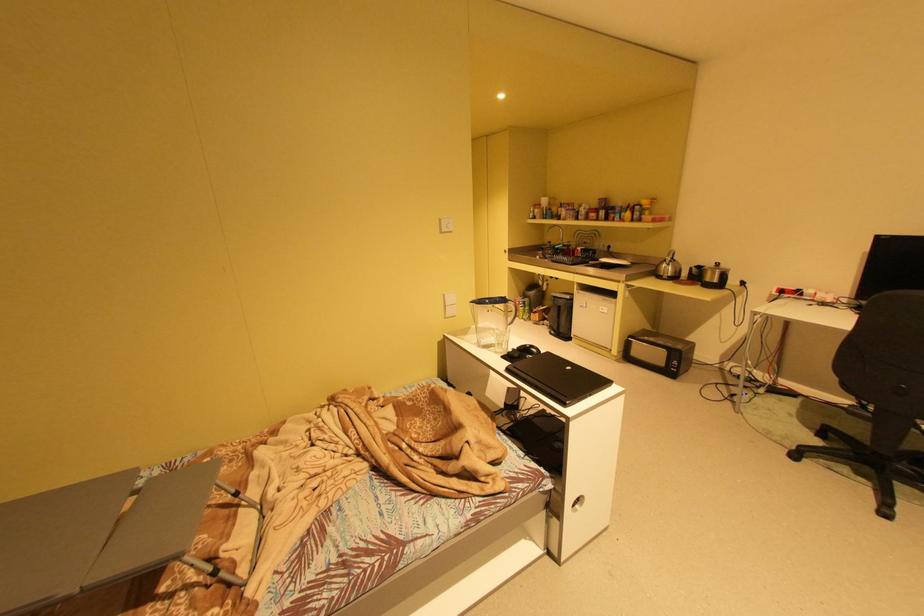
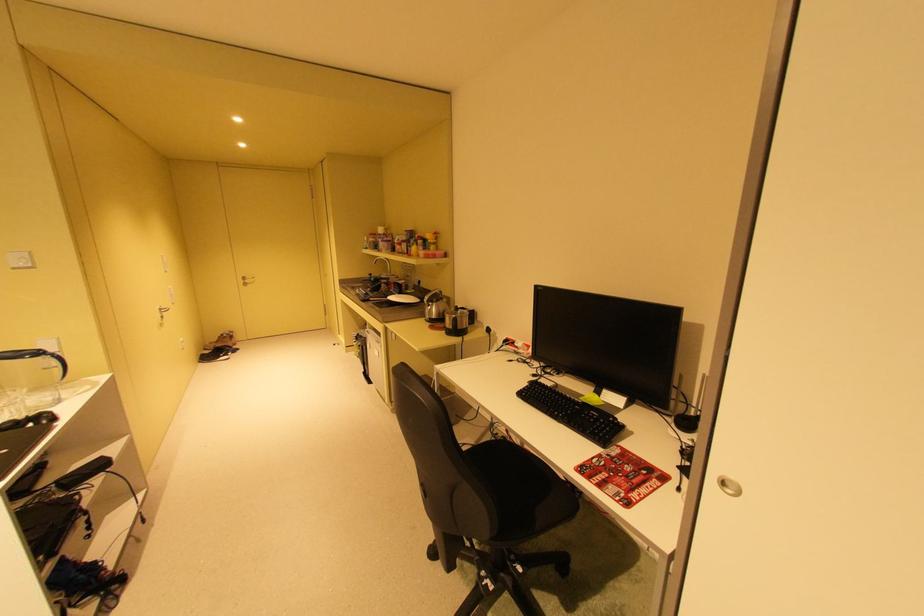
In the second image, find the point that corresponds to point 638,204 in the first image.

(428, 237)